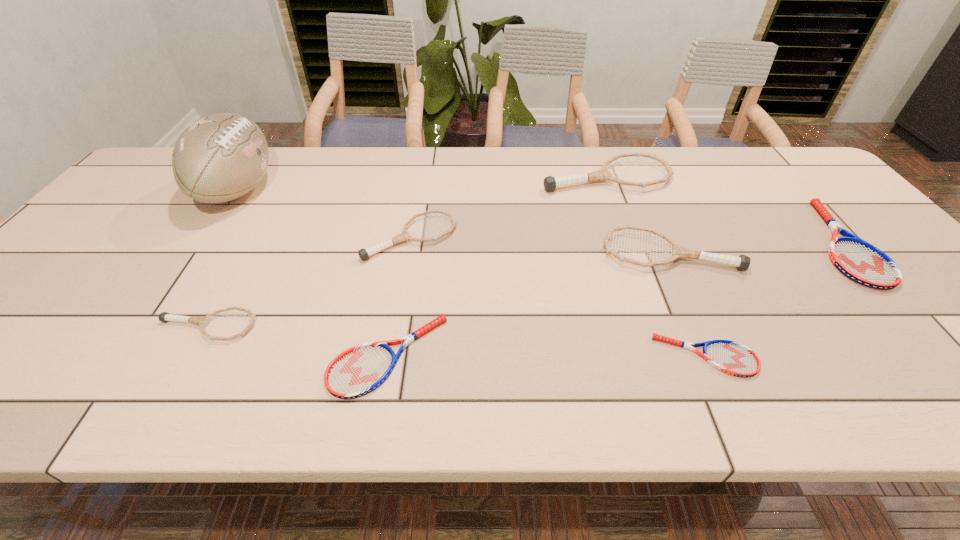
Image resolution: width=960 pixels, height=540 pixels. Find the location of `football (American)`. football (American) is located at coordinates (221, 157).

Where is `the farthest tennis racket`? This screenshot has width=960, height=540. the farthest tennis racket is located at coordinates (550, 183).

Locate an element on the screen. This screenshot has width=960, height=540. the farthest gray tennis racket is located at coordinates (550, 183).

At what (x,y) coordinates should I click in order to perform the action: click on the sixth shortest object. Please return your answer as a coordinate pair (x, y). The image size is (960, 540). Looking at the image, I should click on (742, 262).

Locate an element on the screen. the sixth shortest tennis racket is located at coordinates (742, 262).

The height and width of the screenshot is (540, 960). Identify the location of the second gray tennis racket from left to right. (364, 254).

The image size is (960, 540). I want to click on the second smallest gray tennis racket, so click(x=364, y=254).

Find the location of a particular element. Image resolution: width=960 pixels, height=540 pixels. the smallest gray tennis racket is located at coordinates (164, 317).

Find the location of `the nearest gray tennis racket`. the nearest gray tennis racket is located at coordinates (164, 317).

At what (x,y) coordinates should I click in order to perform the action: click on the farthest blue tennis racket. Please return your answer as a coordinate pair (x, y). This screenshot has height=540, width=960. Looking at the image, I should click on (860, 261).